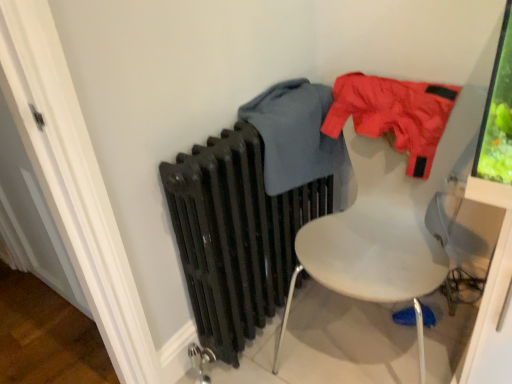
The width and height of the screenshot is (512, 384). What do you see at coordinates (393, 114) in the screenshot?
I see `matte nylon jacket at upper right, which is counted as the first clothing, starting from the right` at bounding box center [393, 114].

Image resolution: width=512 pixels, height=384 pixels. Describe the element at coordinates (298, 138) in the screenshot. I see `matte gray sweater at center, positioned as the 1th clothing in left-to-right order` at that location.

Identify the location of white plastic chair at upper right. The image size is (512, 384). (386, 223).

Considering the relative positions of white plastic chair at upper right and matte gray sweater at center, positioned as the 1th clothing in left-to-right order, in the image provided, is white plastic chair at upper right in front of matte gray sweater at center, positioned as the 1th clothing in left-to-right order,?

Yes, it is in front of matte gray sweater at center, positioned as the 1th clothing in left-to-right order.

Considering the sizes of white plastic chair at upper right and matte gray sweater at center, which appears as the second clothing when viewed from the right, in the image, is white plastic chair at upper right taller or shorter than matte gray sweater at center, which appears as the second clothing when viewed from the right,?

white plastic chair at upper right is taller than matte gray sweater at center, which appears as the second clothing when viewed from the right.

Does white plastic chair at upper right have a larger size compared to matte gray sweater at center, which appears as the second clothing when viewed from the right?

Yes, white plastic chair at upper right is bigger than matte gray sweater at center, which appears as the second clothing when viewed from the right.

Is white plastic chair at upper right not close to matte gray sweater at center, which appears as the second clothing when viewed from the right?

No, white plastic chair at upper right is not far away from matte gray sweater at center, which appears as the second clothing when viewed from the right.

Locate an element on the screen. The height and width of the screenshot is (384, 512). clothing on the left of white plastic chair at upper right is located at coordinates point(298,138).

Considering the sizes of objects matte gray sweater at center, positioned as the 1th clothing in left-to-right order, and white plastic chair at upper right in the image provided, who is shorter, matte gray sweater at center, positioned as the 1th clothing in left-to-right order, or white plastic chair at upper right?

With less height is matte gray sweater at center, positioned as the 1th clothing in left-to-right order.

Which object is further away from the camera, matte gray sweater at center, positioned as the 1th clothing in left-to-right order, or white plastic chair at upper right?

Positioned behind is matte gray sweater at center, positioned as the 1th clothing in left-to-right order.

How much distance is there between matte gray sweater at center, positioned as the 1th clothing in left-to-right order, and white plastic chair at upper right?

matte gray sweater at center, positioned as the 1th clothing in left-to-right order, and white plastic chair at upper right are 9.14 inches apart from each other.

Is matte gray sweater at center, positioned as the 1th clothing in left-to-right order, at the back of matte nylon jacket at upper right, which is counted as the first clothing, starting from the right?

No.

Do you think matte nylon jacket at upper right, which is the second clothing from left to right, is within matte gray sweater at center, which appears as the second clothing when viewed from the right, or outside of it?

matte nylon jacket at upper right, which is the second clothing from left to right, is not enclosed by matte gray sweater at center, which appears as the second clothing when viewed from the right.

Does matte nylon jacket at upper right, which is the second clothing from left to right, have a lesser height compared to matte gray sweater at center, positioned as the 1th clothing in left-to-right order?

Indeed, matte nylon jacket at upper right, which is the second clothing from left to right, has a lesser height compared to matte gray sweater at center, positioned as the 1th clothing in left-to-right order.

Does matte nylon jacket at upper right, which is counted as the first clothing, starting from the right, have a lesser width compared to matte gray sweater at center, positioned as the 1th clothing in left-to-right order?

Correct, the width of matte nylon jacket at upper right, which is counted as the first clothing, starting from the right, is less than that of matte gray sweater at center, positioned as the 1th clothing in left-to-right order.

From the picture: Can you tell me how much matte black radiator at center and white plastic chair at upper right differ in facing direction?

They differ by 82.2 degrees in their facing directions.

From the image's perspective, does matte black radiator at center appear higher than white plastic chair at upper right?

Correct, matte black radiator at center appears higher than white plastic chair at upper right in the image.

Where is `radiator above the white plastic chair at upper right (from the image's perspective)`? This screenshot has height=384, width=512. radiator above the white plastic chair at upper right (from the image's perspective) is located at coordinates click(x=236, y=235).

Considering the relative sizes of matte black radiator at center and white plastic chair at upper right in the image provided, is matte black radiator at center bigger than white plastic chair at upper right?

No, matte black radiator at center is not bigger than white plastic chair at upper right.

Can you confirm if matte gray sweater at center, positioned as the 1th clothing in left-to-right order, is wider than matte black radiator at center?

Indeed, matte gray sweater at center, positioned as the 1th clothing in left-to-right order, has a greater width compared to matte black radiator at center.

Considering the relative sizes of matte gray sweater at center, positioned as the 1th clothing in left-to-right order, and matte black radiator at center in the image provided, is matte gray sweater at center, positioned as the 1th clothing in left-to-right order, bigger than matte black radiator at center?

Incorrect, matte gray sweater at center, positioned as the 1th clothing in left-to-right order, is not larger than matte black radiator at center.

Looking at this image, from a real-world perspective, who is located higher, matte gray sweater at center, which appears as the second clothing when viewed from the right, or matte black radiator at center?

From a 3D spatial view, matte gray sweater at center, which appears as the second clothing when viewed from the right, is above.

How many degrees apart are the facing directions of matte gray sweater at center, which appears as the second clothing when viewed from the right, and matte black radiator at center?

The angular difference between matte gray sweater at center, which appears as the second clothing when viewed from the right, and matte black radiator at center is 8.35e-05 degrees.

Which of these two, white plastic chair at upper right or matte black radiator at center, is wider?

white plastic chair at upper right is wider.

How different are the orientations of white plastic chair at upper right and matte black radiator at center in degrees?

The angle between the facing direction of white plastic chair at upper right and the facing direction of matte black radiator at center is 82.2 degrees.

From the image's perspective, which is above, white plastic chair at upper right or matte black radiator at center?

matte black radiator at center, from the image's perspective.

Does point (425, 241) come behind point (172, 182)?

Yes, it is.

There is a white plastic chair at upper right. At what (x,y) coordinates should I click in order to perform the action: click on the 2nd clothing above it (from a real-world perspective). Please return your answer as a coordinate pair (x, y). This screenshot has width=512, height=384. Looking at the image, I should click on (393, 114).

From their relative heights in the image, would you say matte nylon jacket at upper right, which is counted as the first clothing, starting from the right, is taller or shorter than white plastic chair at upper right?

Clearly, matte nylon jacket at upper right, which is counted as the first clothing, starting from the right, is shorter compared to white plastic chair at upper right.

Between matte nylon jacket at upper right, which is the second clothing from left to right, and white plastic chair at upper right, which one has smaller width?

Thinner between the two is matte nylon jacket at upper right, which is the second clothing from left to right.

Could white plastic chair at upper right be considered to be inside matte nylon jacket at upper right, which is the second clothing from left to right?

Definitely not — white plastic chair at upper right is not inside matte nylon jacket at upper right, which is the second clothing from left to right.

Where is `the 1st clothing directly above the white plastic chair at upper right (from a real-world perspective)`? This screenshot has width=512, height=384. the 1st clothing directly above the white plastic chair at upper right (from a real-world perspective) is located at coordinates (298, 138).

Locate an element on the screen. The height and width of the screenshot is (384, 512). clothing that is the 1st object located behind the white plastic chair at upper right is located at coordinates (298, 138).

Considering their positions, is white plastic chair at upper right positioned closer to matte nylon jacket at upper right, which is counted as the first clothing, starting from the right, than matte black radiator at center?

Based on the image, white plastic chair at upper right appears to be nearer to matte nylon jacket at upper right, which is counted as the first clothing, starting from the right.

Consider the image. Looking at the image, which one is located further to matte gray sweater at center, which appears as the second clothing when viewed from the right, matte black radiator at center or white plastic chair at upper right?

white plastic chair at upper right.

In the scene shown: Looking at the image, which one is located closer to matte black radiator at center, white plastic chair at upper right or matte nylon jacket at upper right, which is the second clothing from left to right?

The object closer to matte black radiator at center is white plastic chair at upper right.

Which object lies nearer to the anchor point matte gray sweater at center, positioned as the 1th clothing in left-to-right order, white plastic chair at upper right or matte nylon jacket at upper right, which is the second clothing from left to right?

Among the two, matte nylon jacket at upper right, which is the second clothing from left to right, is located nearer to matte gray sweater at center, positioned as the 1th clothing in left-to-right order.

Consider the image. Based on their spatial positions, is white plastic chair at upper right or matte black radiator at center further from matte gray sweater at center, positioned as the 1th clothing in left-to-right order?

The object further to matte gray sweater at center, positioned as the 1th clothing in left-to-right order, is white plastic chair at upper right.

Considering their positions, is matte nylon jacket at upper right, which is counted as the first clothing, starting from the right, positioned further to matte gray sweater at center, positioned as the 1th clothing in left-to-right order, than white plastic chair at upper right?

white plastic chair at upper right is positioned further to the anchor matte gray sweater at center, positioned as the 1th clothing in left-to-right order.

Which object lies nearer to the anchor point white plastic chair at upper right, matte gray sweater at center, which appears as the second clothing when viewed from the right, or matte black radiator at center?

Based on the image, matte gray sweater at center, which appears as the second clothing when viewed from the right, appears to be nearer to white plastic chair at upper right.

Based on their spatial positions, is matte gray sweater at center, which appears as the second clothing when viewed from the right, or white plastic chair at upper right closer to matte nylon jacket at upper right, which is the second clothing from left to right?

Among the two, white plastic chair at upper right is located nearer to matte nylon jacket at upper right, which is the second clothing from left to right.

Locate an element on the screen. The height and width of the screenshot is (384, 512). clothing between matte black radiator at center and white plastic chair at upper right in the horizontal direction is located at coordinates (298, 138).

Identify the location of chair situated between matte black radiator at center and matte nylon jacket at upper right, which is the second clothing from left to right, from left to right. (386, 223).

Locate an element on the screen. clothing between white plastic chair at upper right and matte nylon jacket at upper right, which is counted as the first clothing, starting from the right, along the z-axis is located at coordinates (298, 138).

This screenshot has height=384, width=512. What are the coordinates of `clothing between matte black radiator at center and matte nylon jacket at upper right, which is counted as the first clothing, starting from the right, from left to right` in the screenshot? It's located at (298, 138).